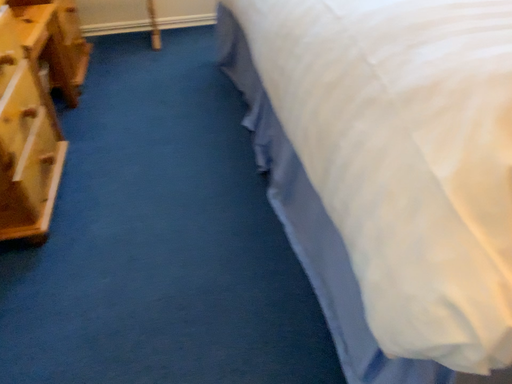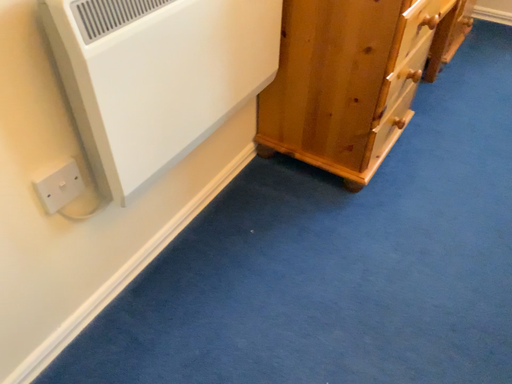
Question: Which way did the camera rotate in the video?

Choices:
 (A) rotated right
 (B) rotated left

Answer: (B)